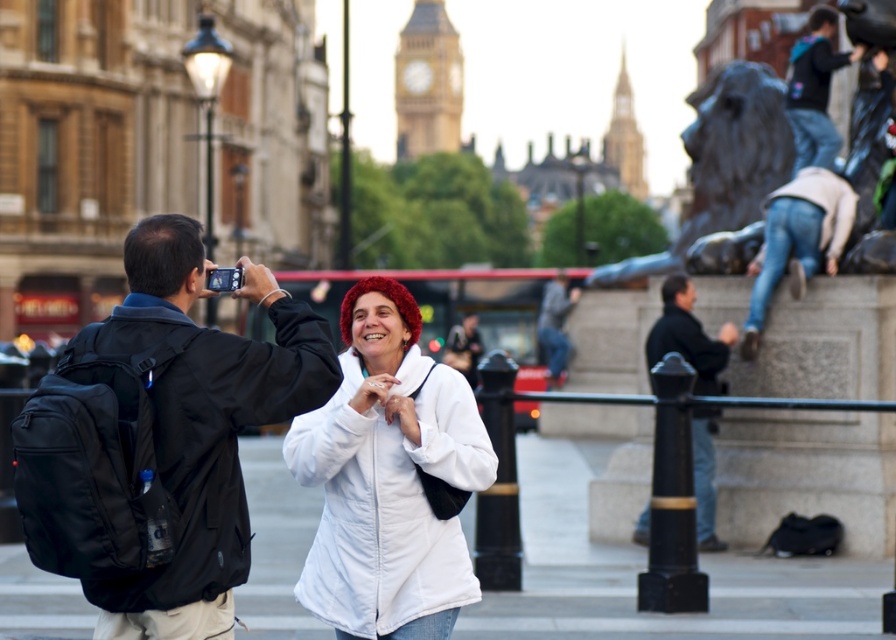
Question: Among these points, which one is nearest to the camera?

Choices:
 (A) (372, 336)
 (B) (714, 380)
 (C) (197, 356)
 (D) (569, 298)

Answer: (C)

Question: Is golden stone clock tower at upper center smaller than dark gray jacket at center?

Choices:
 (A) no
 (B) yes

Answer: (A)

Question: Which of the following is the farthest from the observer?

Choices:
 (A) dark blue jeans at right
 (B) white fleece jacket at center
 (C) black fabric jacket at left
 (D) dark gray jacket at center

Answer: (D)

Question: Does black fabric jacket at left appear on the left side of dark gray jacket at center?

Choices:
 (A) no
 (B) yes

Answer: (B)

Question: Which point is closer to the camera?

Choices:
 (A) dark blue jeans at right
 (B) black fabric jacket at left
 (C) golden stone clock tower at upper center

Answer: (B)

Question: Considering the relative positions of white fleece jacket at center and golden stone clock tower at upper center in the image provided, where is white fleece jacket at center located with respect to golden stone clock tower at upper center?

Choices:
 (A) above
 (B) below

Answer: (B)